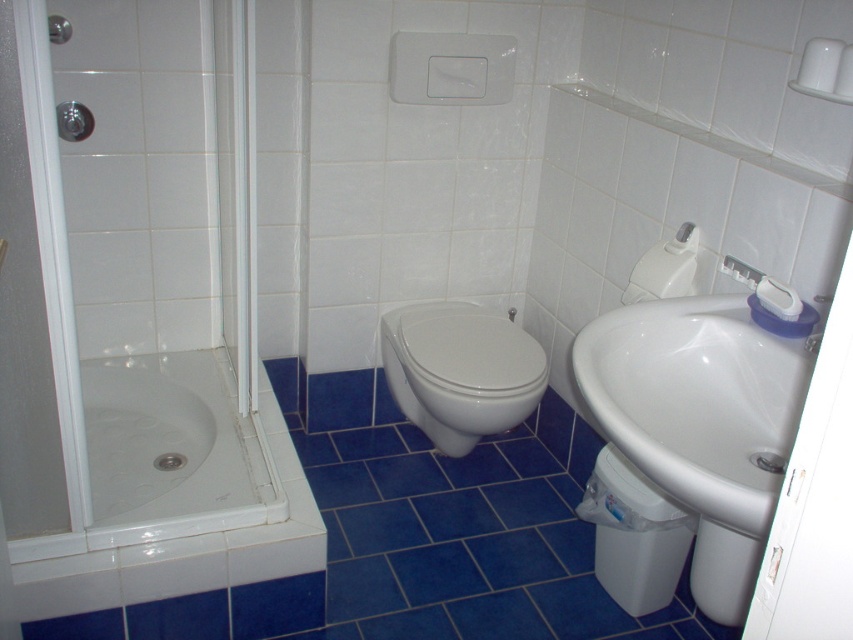
You are a plumber checking the bathroom layout. You need to install a new pipe that connects the white glossy faucet at upper right to the white glossy bidet at center. Based on their positions, will the pipe need to go downward from the faucet to reach the bidet?

Yes, the pipe will need to go downward from the white glossy faucet at upper right to reach the white glossy bidet at center because the bidet is positioned under the faucet.